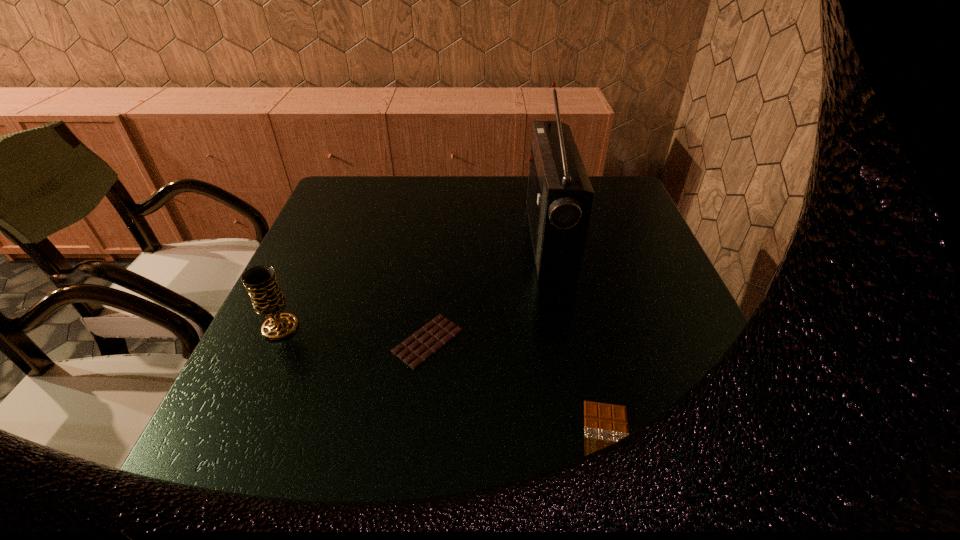
I want to click on the tallest object, so click(559, 197).

Find the location of a particular element. This screenshot has height=540, width=960. radio receiver is located at coordinates (559, 197).

Identify the location of the second tallest object. (268, 300).

Where is `the leftmost object`? This screenshot has height=540, width=960. the leftmost object is located at coordinates (268, 300).

The height and width of the screenshot is (540, 960). I want to click on the third tallest object, so (x=420, y=346).

Where is `the farther chocolate bar`? This screenshot has width=960, height=540. the farther chocolate bar is located at coordinates (420, 346).

This screenshot has height=540, width=960. What are the coordinates of `the nearest object` in the screenshot? It's located at (604, 424).

This screenshot has height=540, width=960. In order to click on the shortest object in this screenshot , I will do `click(604, 424)`.

Where is `free space located 0.230m on the front-facing side of the farthest object`? The width and height of the screenshot is (960, 540). free space located 0.230m on the front-facing side of the farthest object is located at coordinates (444, 240).

This screenshot has width=960, height=540. In order to click on free spot located on the front-facing side of the farthest object in this screenshot , I will do `click(379, 240)`.